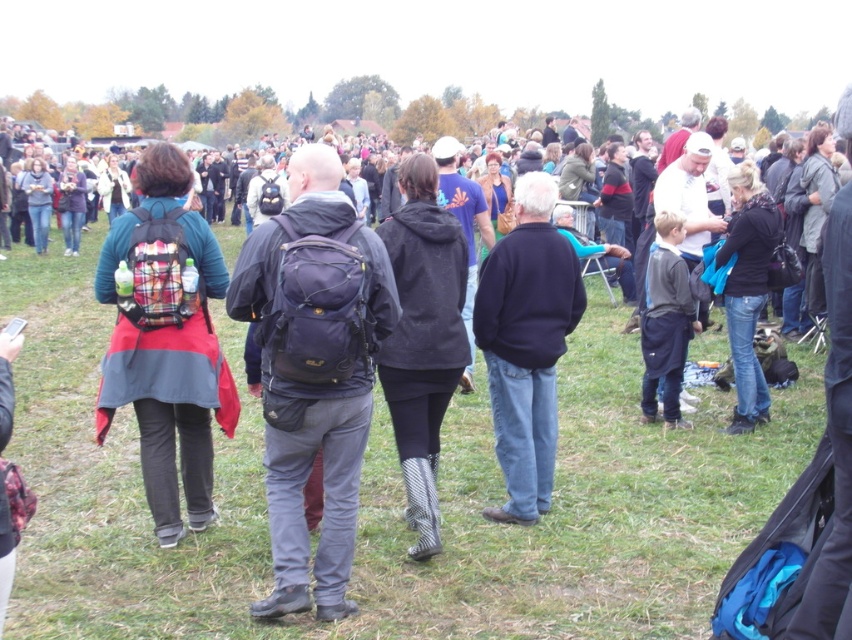
Based on the photo, you are standing in the crowd at the event and want to take a photo of both the point at coordinate (x=524, y=260) and the point at coordinate (x=661, y=308). Which point will appear larger in your photo?

Point at coordinate (x=524, y=260) will appear larger in the photo because it is closer to the camera than point at coordinate (x=661, y=308).